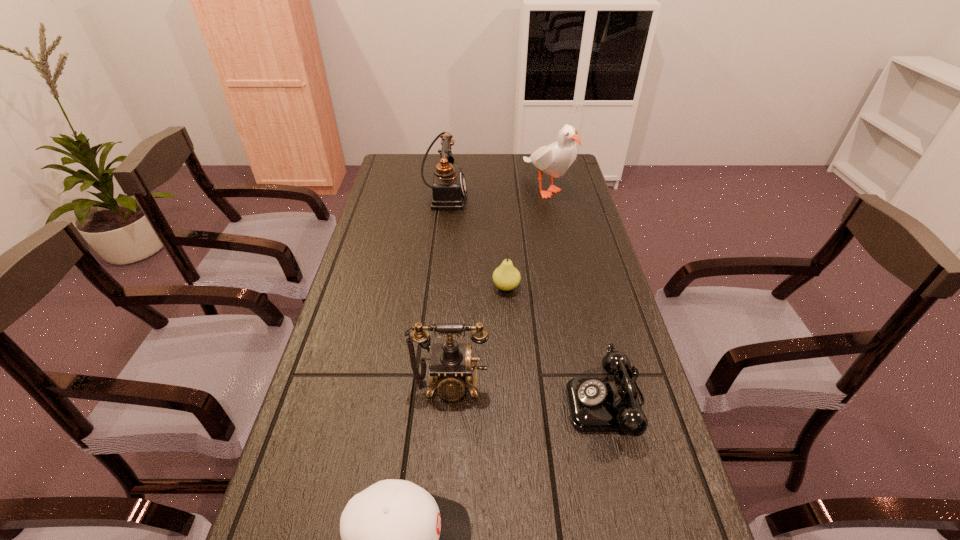
Identify the location of the tallest object. (554, 159).

Locate an element on the screen. the farthest telephone is located at coordinates (449, 188).

Locate an element on the screen. This screenshot has width=960, height=540. pear is located at coordinates 506,277.

Find the location of a particular element. Image resolution: width=960 pixels, height=540 pixels. the third farthest object is located at coordinates (506, 277).

Find the location of a particular element. This screenshot has width=960, height=540. the rightmost telephone is located at coordinates (595, 404).

You are a GUI agent. You are given a task and a screenshot of the screen. Output one action in this format:
    pyautogui.click(x=<x>, y=<y>)
    Task: Click on the free location located 0.260m at the beak of the gull
    This screenshot has width=960, height=540.
    Given the screenshot: What is the action you would take?
    [x=562, y=257]

Locate an element on the screen. free spot located on the front of the farthest telephone at the rotary dial is located at coordinates (514, 196).

At what (x,y) coordinates should I click in order to perform the action: click on vacant area located on the left of the pear. Please return your answer as a coordinate pair (x, y). Looking at the image, I should click on point(447,287).

I want to click on free space located 0.170m on the dial of the rightmost telephone, so click(492, 403).

The height and width of the screenshot is (540, 960). Find the location of `blank area located 0.180m on the dial of the rightmost telephone`. blank area located 0.180m on the dial of the rightmost telephone is located at coordinates (488, 403).